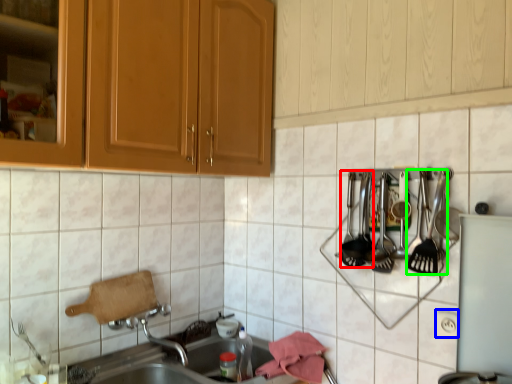
Question: Estimate the real-world distances between objects in this image. Which object is farther from silverware (highlighted by a red box), electric outlet (highlighted by a blue box) or silverware (highlighted by a green box)?

Choices:
 (A) electric outlet
 (B) silverware

Answer: (A)